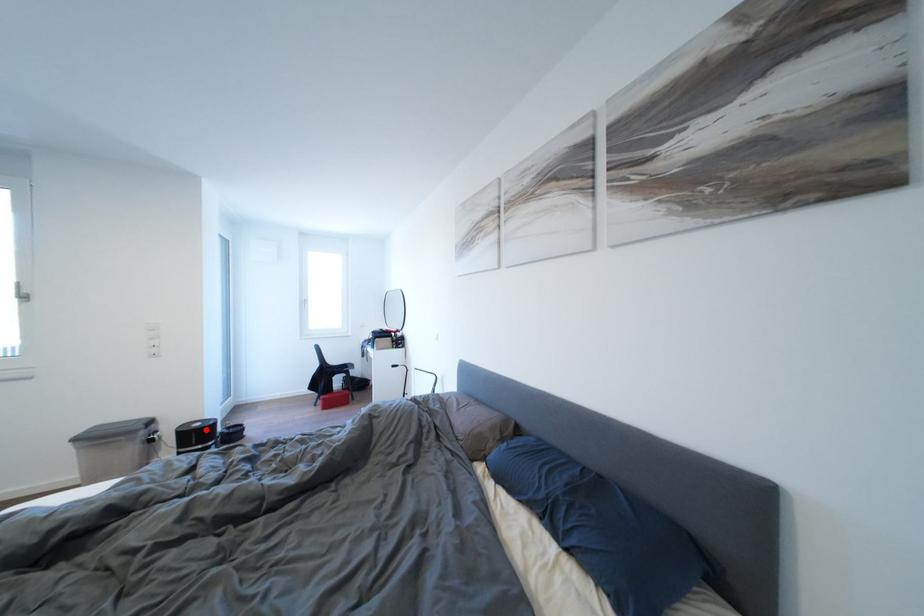
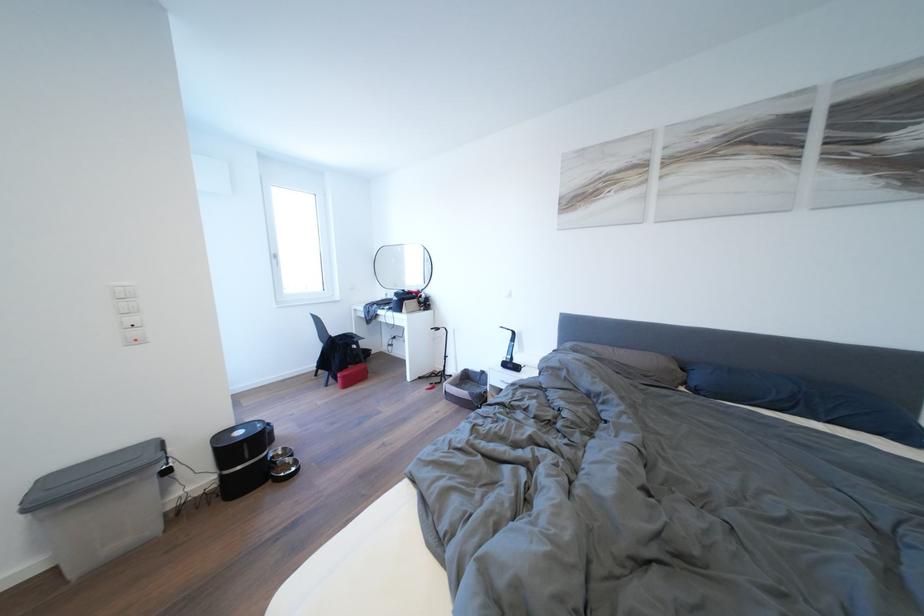
Question: I am providing you with two images of the same scene from different viewpoints. In image1, a red point is highlighted. Considering the same 3D point in image2, which of the following is correct?

Choices:
 (A) It is closer
 (B) It is farther

Answer: (A)